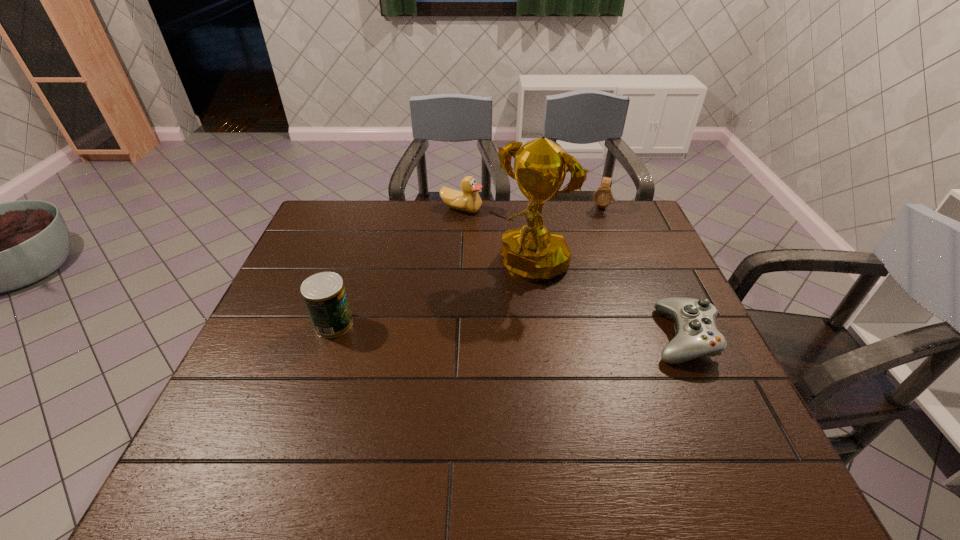
The width and height of the screenshot is (960, 540). Find the location of `vacant spot on the desktop that is between the can and the control and is positioned on the face of the watch`. vacant spot on the desktop that is between the can and the control and is positioned on the face of the watch is located at coordinates (554, 332).

I want to click on free space on the desktop that is between the can and the control and is positioned on the front side of the third object from left to right, so click(x=474, y=329).

Identify the location of free space on the desktop that is between the leftmost object and the shortest object and is positioned at the beak of the duck. (541, 331).